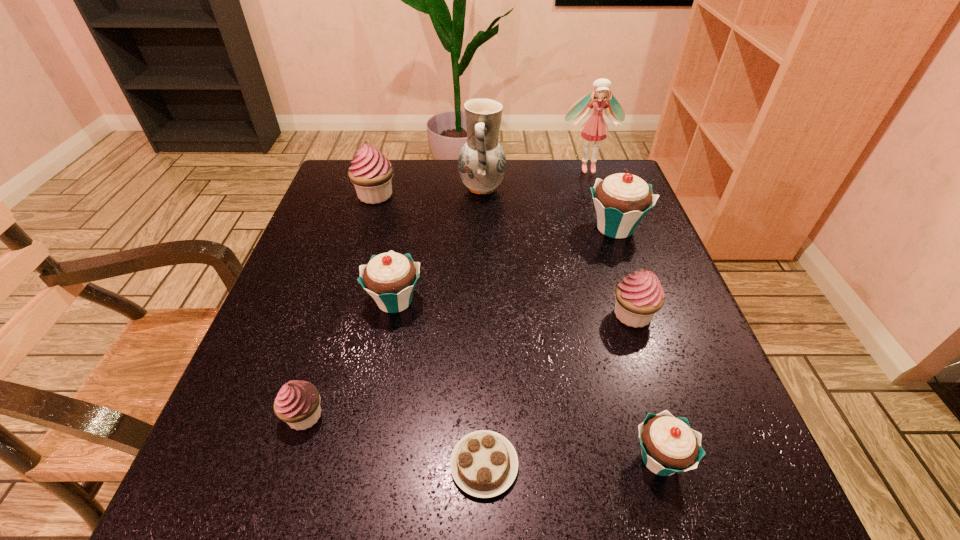
The width and height of the screenshot is (960, 540). Identify the location of doll. (595, 128).

You are a GUI agent. You are given a task and a screenshot of the screen. Output one action in this format:
    pyautogui.click(x=<x>, y=<y>)
    Task: Click on the pottery
    The height and width of the screenshot is (540, 960).
    Given the screenshot: What is the action you would take?
    pyautogui.click(x=482, y=161)

Find the location of a particular element. This screenshot has height=540, width=960. the biggest pink cupcake is located at coordinates (371, 172).

In order to click on the farthest pink cupcake in this screenshot , I will do `click(371, 172)`.

This screenshot has width=960, height=540. Find the location of `the farthest teal cupcake`. the farthest teal cupcake is located at coordinates (622, 200).

Locate an element on the screen. the second farthest cupcake is located at coordinates (622, 200).

Where is `the second farthest teal cupcake`? the second farthest teal cupcake is located at coordinates (389, 278).

Identify the location of the leftmost teal cupcake. This screenshot has width=960, height=540. (389, 278).

Image resolution: width=960 pixels, height=540 pixels. Find the location of `the rightmost pink cupcake`. the rightmost pink cupcake is located at coordinates (640, 295).

What are the coordinates of `the second nearest pink cupcake` in the screenshot? It's located at (640, 295).